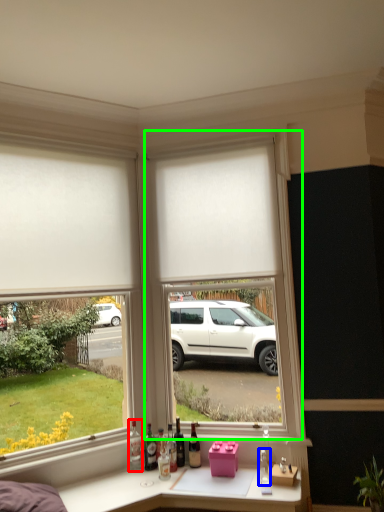
Question: Estimate the real-world distances between objects in this image. Which object is farther from bottle (highlighted by a red box), bottle (highlighted by a blue box) or window frame (highlighted by a green box)?

Choices:
 (A) bottle
 (B) window frame

Answer: (B)